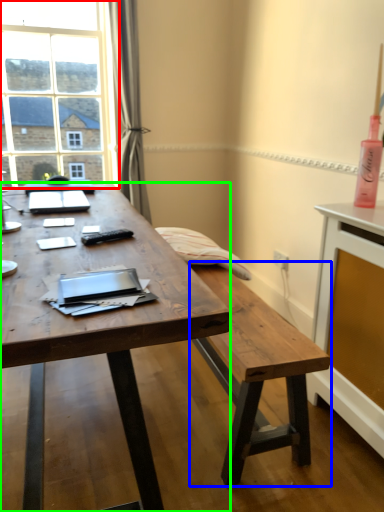
Question: Which object is the closest to the window (highlighted by a red box)? Choose among these: bench (highlighted by a blue box) or desk (highlighted by a green box).

Choices:
 (A) bench
 (B) desk

Answer: (B)